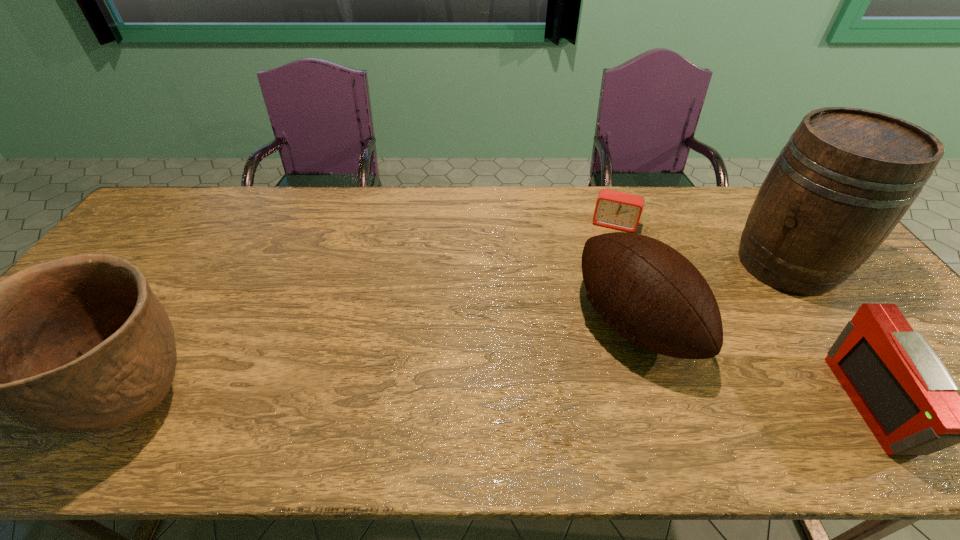
Locate an element on the screen. The height and width of the screenshot is (540, 960). pottery is located at coordinates (80, 344).

Locate an element on the screen. The image size is (960, 540). the leftmost object is located at coordinates (80, 344).

Find the location of a particular element. The image size is (960, 540). the fourth tallest object is located at coordinates (908, 398).

The width and height of the screenshot is (960, 540). What are the coordinates of `football` in the screenshot? It's located at (647, 291).

You are a GUI agent. You are given a task and a screenshot of the screen. Output one action in this format:
    pyautogui.click(x=<x>, y=<y>)
    Task: Click on the alarm clock
    
    Given the screenshot: What is the action you would take?
    pyautogui.click(x=618, y=210)

Locate an element on the screen. This screenshot has height=540, width=960. the tallest object is located at coordinates (846, 177).

I want to click on blank space located 0.310m on the back of the leftmost object, so click(227, 262).

Locate an element on the screen. Image resolution: width=960 pixels, height=540 pixels. vacant space situated on the front-facing side of the second shortest object is located at coordinates (924, 404).

The height and width of the screenshot is (540, 960). In order to click on vacant region located on the laces of the third shortest object in this screenshot , I will do `click(579, 362)`.

Locate an element on the screen. This screenshot has width=960, height=540. free location located 0.100m on the laces of the third shortest object is located at coordinates (563, 372).